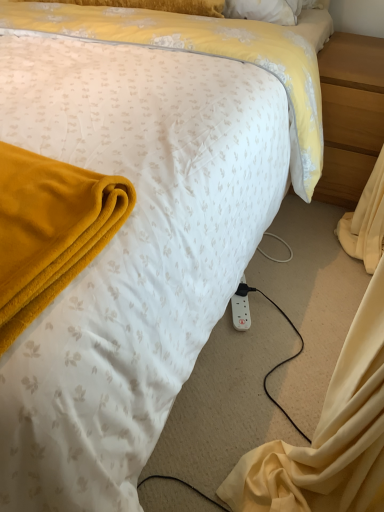
Locate an element on the screen. This screenshot has height=512, width=384. vacant area that lies in front of light brown wood at right is located at coordinates (309, 239).